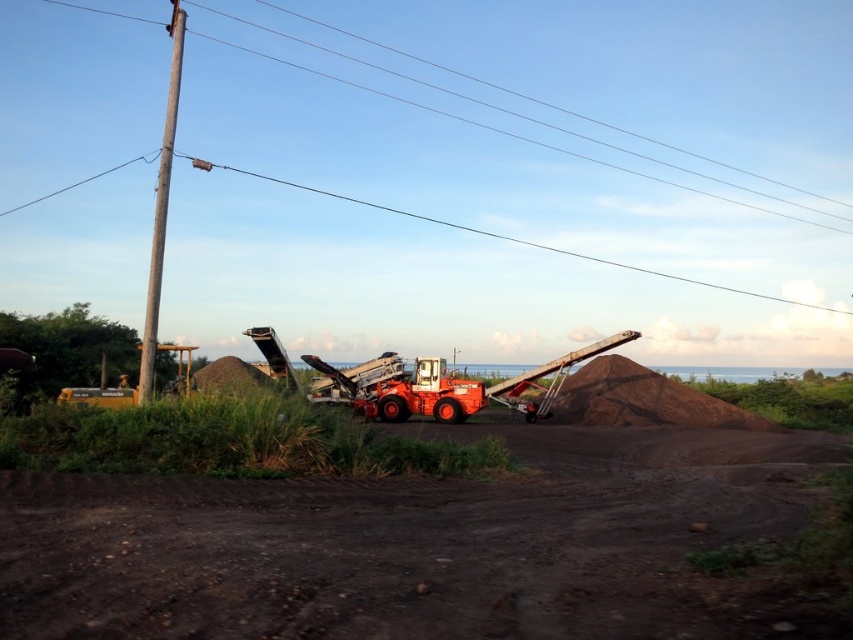
You are a delivery truck driver who needs to navigate through the construction site. You see a dirt track at center and a brown wooden telegraph pole at left. Which object is positioned to the right of the other?

The dirt track at center is to the right of the brown wooden telegraph pole at left according to the description.